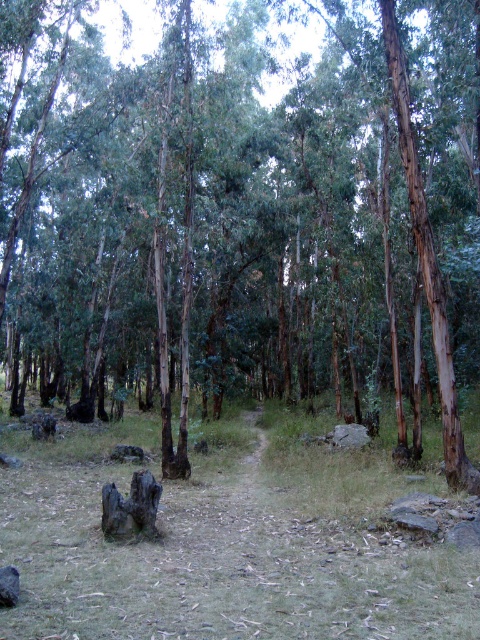
You are standing on the dirt path in the forest and want to step onto the green grass at center. Based on its position, can you determine if the grass is directly in front of you or to your side?

The green grass at center is located at point 0.856 on the x and 0.458 on the y coordinate, which places it directly in front of you along the central path.

You are a hiker who wants to place a small backpack on the ground. You see the green grass at center and the charred wood stump at center. Which location would be more stable for placing your backpack?

The charred wood stump at center is more stable because the green grass at center is positioned under it, which might be uneven or unstable compared to the solid stump.